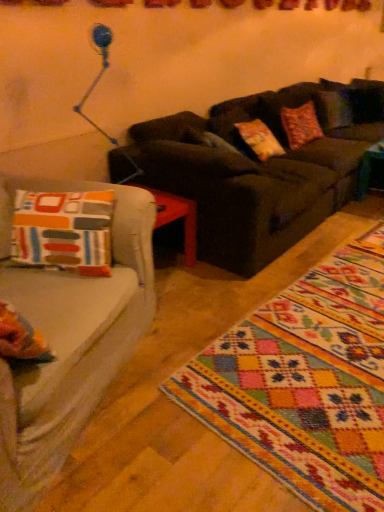
Where is `multicolored woven rug at lower right`? multicolored woven rug at lower right is located at coordinates (305, 382).

The width and height of the screenshot is (384, 512). What do you see at coordinates (305, 382) in the screenshot? I see `multicolored woven rug at lower right` at bounding box center [305, 382].

Measure the distance between point (304,202) and camera.

A distance of 2.89 meters exists between point (304,202) and camera.

Find the location of a particular element. This screenshot has height=512, width=384. dark brown leather couch at center is located at coordinates (261, 168).

In order to face dark brown leather couch at center, should I rotate leftwards or rightwards?

Turn right approximately 14.736 degrees to face it.

What do you see at coordinates (261, 168) in the screenshot? This screenshot has width=384, height=512. I see `dark brown leather couch at center` at bounding box center [261, 168].

This screenshot has height=512, width=384. I want to click on multicolored woven rug at lower right, so click(x=305, y=382).

Is dark brown leather couch at center at the right side of multicolored woven rug at lower right?

No, dark brown leather couch at center is not to the right of multicolored woven rug at lower right.

Is dark brown leather couch at center further to the viewer compared to multicolored woven rug at lower right?

Yes.

Considering the positions of points (339, 158) and (365, 289), is point (339, 158) farther from camera compared to point (365, 289)?

Yes, point (339, 158) is farther from viewer.

From the image's perspective, is dark brown leather couch at center positioned above or below multicolored woven rug at lower right?

dark brown leather couch at center is situated higher than multicolored woven rug at lower right in the image.

Consider the image. From a real-world perspective, between dark brown leather couch at center and multicolored woven rug at lower right, who is vertically higher?

From a 3D spatial view, dark brown leather couch at center is above.

Between dark brown leather couch at center and multicolored woven rug at lower right, which one has larger width?

multicolored woven rug at lower right is wider.

Is dark brown leather couch at center taller than multicolored woven rug at lower right?

Yes.

Considering the sizes of dark brown leather couch at center and multicolored woven rug at lower right in the image, is dark brown leather couch at center bigger or smaller than multicolored woven rug at lower right?

Clearly, dark brown leather couch at center is larger in size than multicolored woven rug at lower right.

Is multicolored woven rug at lower right a part of dark brown leather couch at center?

No, multicolored woven rug at lower right is not inside dark brown leather couch at center.

Is dark brown leather couch at center positioned far away from multicolored woven rug at lower right?

Indeed, dark brown leather couch at center is not near multicolored woven rug at lower right.

Is dark brown leather couch at center oriented towards multicolored woven rug at lower right?

Yes, dark brown leather couch at center is aimed at multicolored woven rug at lower right.

From the picture: Can you tell me how much dark brown leather couch at center and multicolored woven rug at lower right differ in facing direction?

87.2 degrees separate the facing orientations of dark brown leather couch at center and multicolored woven rug at lower right.

The image size is (384, 512). In order to click on mat on the right of dark brown leather couch at center in this screenshot , I will do `click(305, 382)`.

Between multicolored woven rug at lower right and dark brown leather couch at center, which one appears on the right side from the viewer's perspective?

multicolored woven rug at lower right.

Is multicolored woven rug at lower right behind dark brown leather couch at center?

No, it is not.

Which is nearer, [291,302] or [175,126]?

The point [291,302] is in front.

From the picture: From the image's perspective, between multicolored woven rug at lower right and dark brown leather couch at center, who is located below?

multicolored woven rug at lower right appears lower in the image.

From a real-world perspective, who is located higher, multicolored woven rug at lower right or dark brown leather couch at center?

dark brown leather couch at center, from a real-world perspective.

Between multicolored woven rug at lower right and dark brown leather couch at center, which one has larger width?

multicolored woven rug at lower right.

Can you confirm if multicolored woven rug at lower right is taller than dark brown leather couch at center?

Incorrect, the height of multicolored woven rug at lower right is not larger of that of dark brown leather couch at center.

Can you confirm if multicolored woven rug at lower right is bigger than dark brown leather couch at center?

No, multicolored woven rug at lower right is not bigger than dark brown leather couch at center.

Looking at this image, is dark brown leather couch at center surrounded by multicolored woven rug at lower right?

No, dark brown leather couch at center is not inside multicolored woven rug at lower right.

Is multicolored woven rug at lower right touching dark brown leather couch at center?

No, multicolored woven rug at lower right is not beside dark brown leather couch at center.

Is multicolored woven rug at lower right aimed at dark brown leather couch at center?

No, multicolored woven rug at lower right is not turned towards dark brown leather couch at center.

From the picture: How many degrees apart are the facing directions of multicolored woven rug at lower right and dark brown leather couch at center?

There is a 87.2-degree angle between the facing directions of multicolored woven rug at lower right and dark brown leather couch at center.

Measure the distance from multicolored woven rug at lower right to dark brown leather couch at center.

The distance of multicolored woven rug at lower right from dark brown leather couch at center is 1.18 meters.

Image resolution: width=384 pixels, height=512 pixels. I want to click on mat below the dark brown leather couch at center (from a real-world perspective), so click(305, 382).

Where is `studio couch behind the multicolored woven rug at lower right`? Image resolution: width=384 pixels, height=512 pixels. studio couch behind the multicolored woven rug at lower right is located at coordinates (261, 168).

Locate an element on the screen. This screenshot has width=384, height=512. studio couch above the multicolored woven rug at lower right (from the image's perspective) is located at coordinates (261, 168).